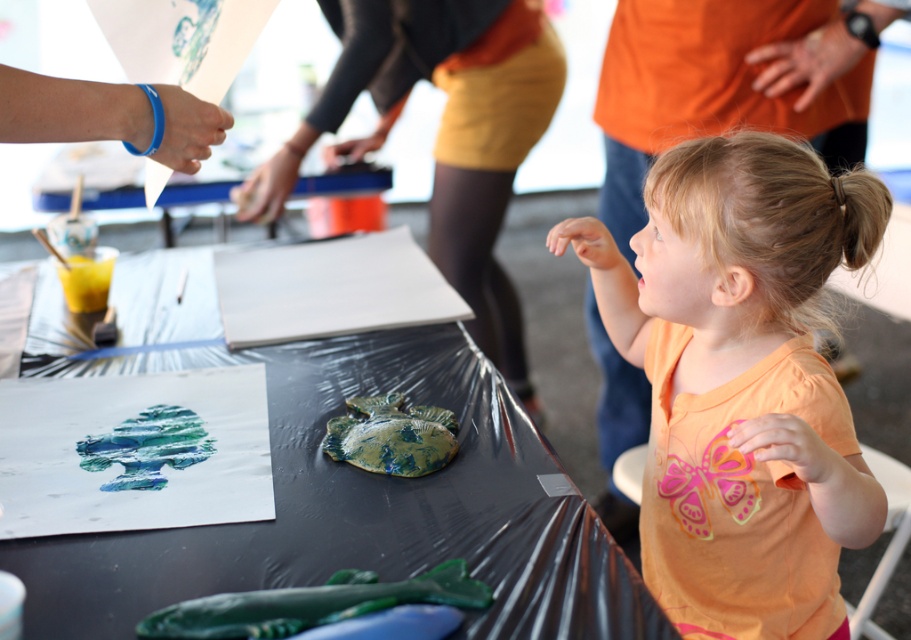
You are a photographer trying to capture a candid shot of the child without them noticing. You need to position yourself so that the shiny plastic table at center does not block your view of the blonde hair at upper right. Is this possible based on their positions?

The shiny plastic table at center is below blonde hair at upper right, so positioning yourself above the table or to the side where the hair is visible would allow you to capture the shot without the table blocking the view.

The point at coordinates (147, 445) is located on which object in the scene?

The point at coordinates (147, 445) is on the watercolor painting at center.

You are a photographer at the children art event. You want to take a photo of the watercolor painting at center. The camera you are using has a minimum focusing distance of 30 inches. Can you take a clear photo without moving the camera or the painting?

The watercolor painting at center and camera are 31.72 inches apart. Since the distance is more than the camera minimum focusing distance of 30 inches, you can take a clear photo without moving the camera or the painting.